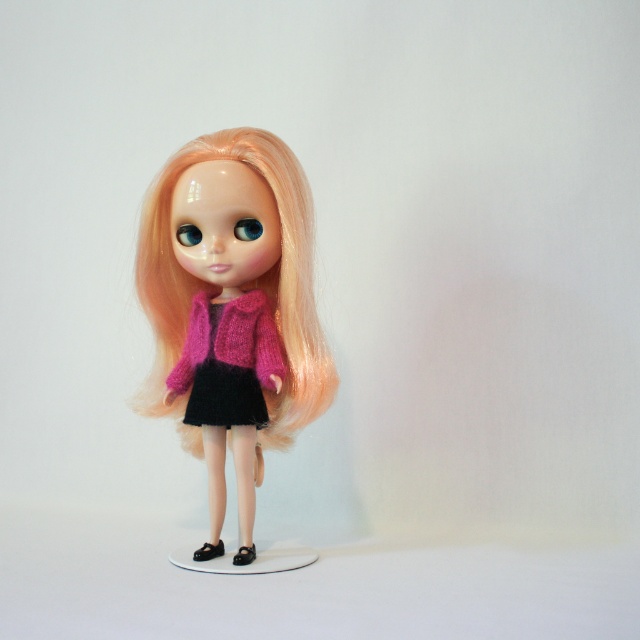
The height and width of the screenshot is (640, 640). I want to click on pink knitted sweater at center, so click(232, 308).

Who is lower down, pink knitted sweater at center or fuzzy pink sweater at center?

pink knitted sweater at center is below.

Who is more forward, (244, 396) or (186, 387)?

Positioned in front is point (244, 396).

Identify the location of pink knitted sweater at center. (232, 308).